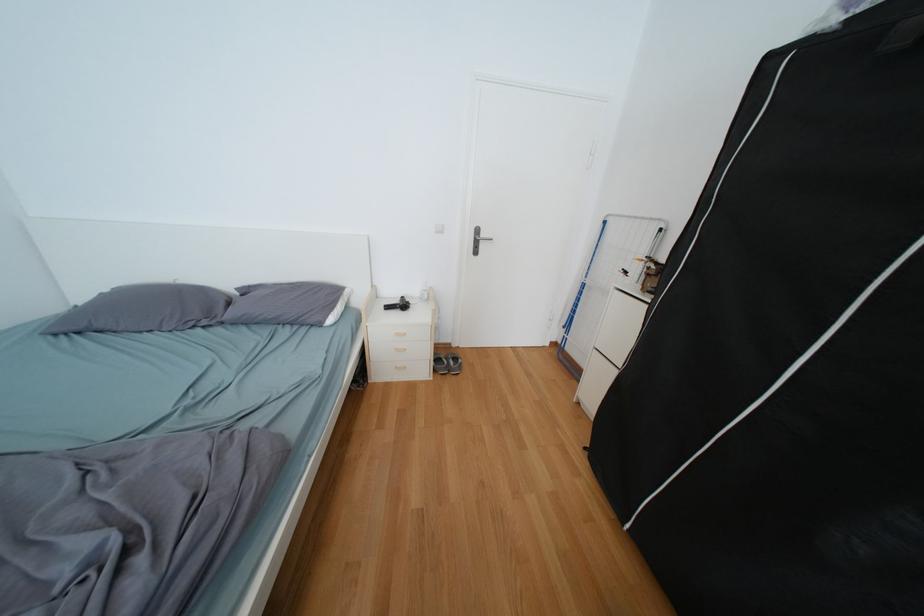
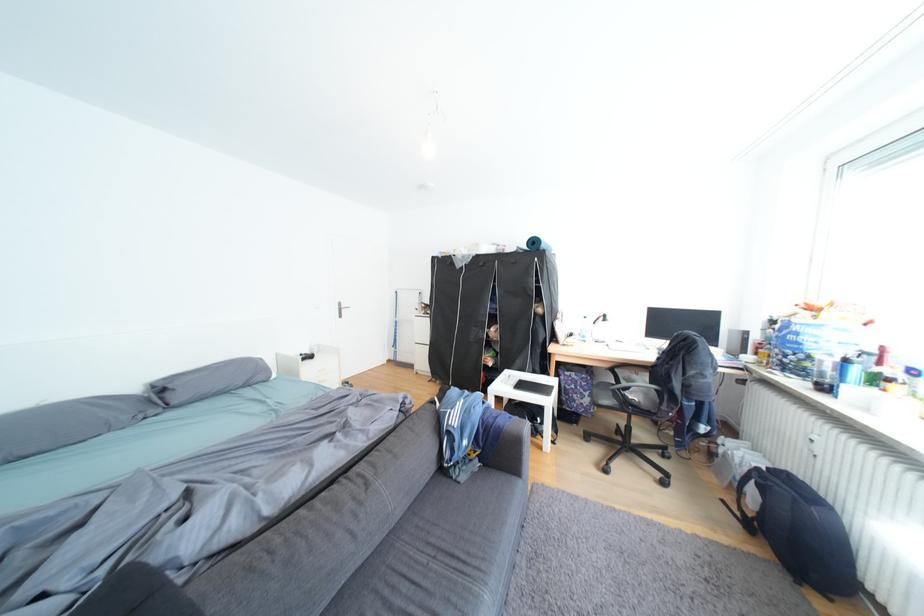
The point at (x=113, y=328) is marked in the first image. Where is the corresponding point in the second image?

(40, 453)